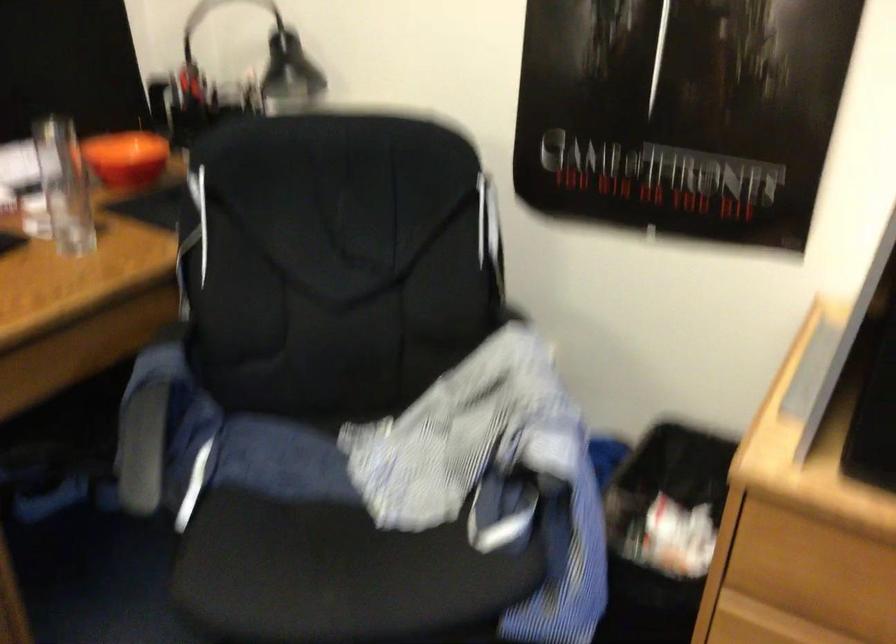
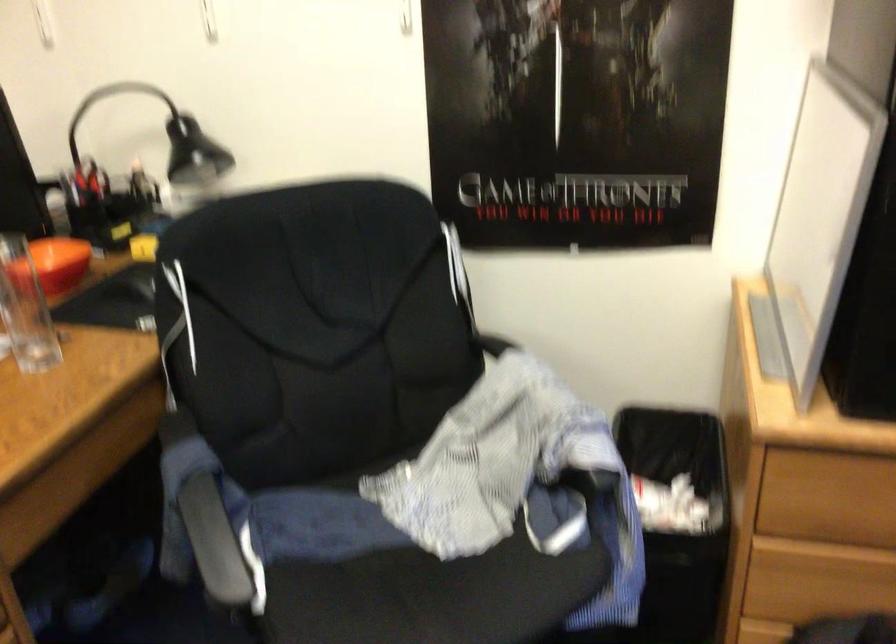
Question: In a continuous first-person perspective shot, in which direction is the camera moving?

Choices:
 (A) Left
 (B) Right
 (C) Forward
 (D) Backward

Answer: (A)